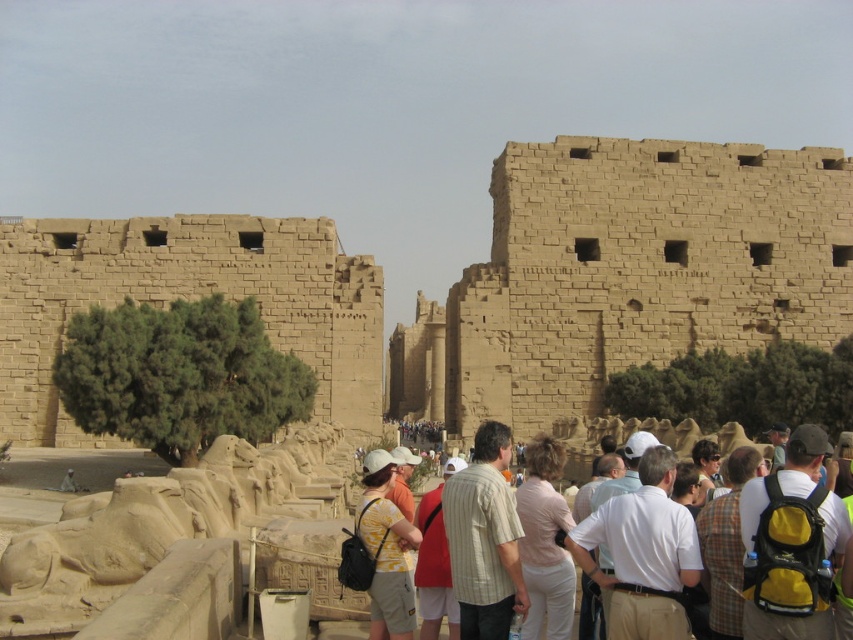
Is point (693, 548) farther from camera compared to point (723, 625)?

Yes, point (693, 548) is farther from viewer.

Is light brown fabric crowd at center further to the viewer compared to plaid fabric shirt at center-right?

No, light brown fabric crowd at center is in front of plaid fabric shirt at center-right.

Between point (602, 573) and point (744, 460), which one is positioned behind?

The point (744, 460) is more distant.

Locate an element on the screen. This screenshot has width=853, height=640. light brown fabric crowd at center is located at coordinates (807, 449).

Does light brown fabric crowd at center have a smaller size compared to red fabric shirt at center?

No, light brown fabric crowd at center is not smaller than red fabric shirt at center.

Measure the distance between point (740, 637) and camera.

Point (740, 637) and camera are 153.59 feet apart.

Locate an element on the screen. Image resolution: width=853 pixels, height=640 pixels. light brown fabric crowd at center is located at coordinates (807, 449).

Locate an element on the screen. The height and width of the screenshot is (640, 853). light brown fabric crowd at center is located at coordinates (807, 449).

Which is behind, point (489, 515) or point (810, 493)?

The point (489, 515) is behind.

Is striped cotton shirt at center bigger than light brown fabric crowd at center?

Correct, striped cotton shirt at center is larger in size than light brown fabric crowd at center.

Between point (479, 444) and point (666, 529), which one is positioned in front?

Point (666, 529) is in front.

Identify the location of striped cotton shirt at center. (485, 538).